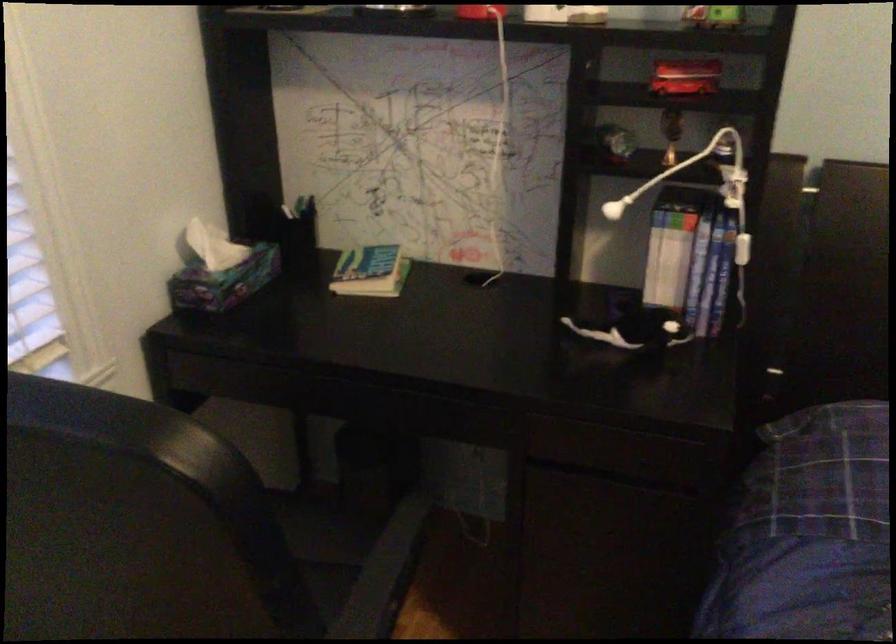
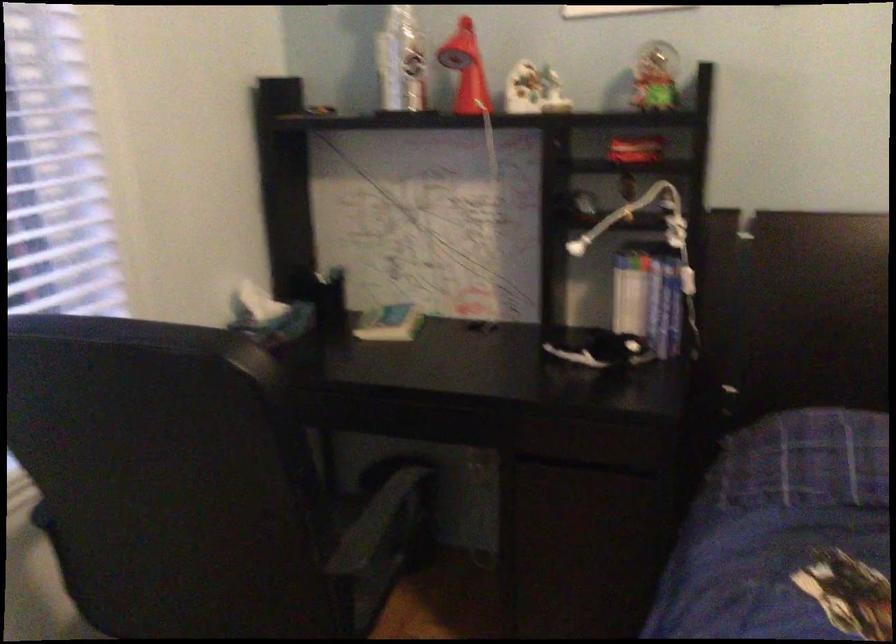
Question: Which direction would the cameraman need to move to produce the second image? Reply with the corresponding letter.

Choices:
 (A) Left
 (B) Right
 (C) Forward
 (D) Backward

Answer: (D)